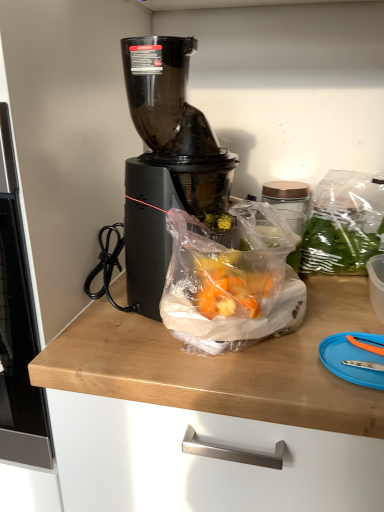
Question: Does translucent plastic bag at center turn towards blue plastic cutting board at lower right?

Choices:
 (A) no
 (B) yes

Answer: (A)

Question: Is translucent plastic bag at center surrounding blue plastic cutting board at lower right?

Choices:
 (A) yes
 (B) no

Answer: (B)

Question: Can you confirm if translucent plastic bag at center is thinner than blue plastic cutting board at lower right?

Choices:
 (A) no
 (B) yes

Answer: (A)

Question: Can you confirm if translucent plastic bag at center is smaller than blue plastic cutting board at lower right?

Choices:
 (A) no
 (B) yes

Answer: (A)

Question: From the image's perspective, is translucent plastic bag at center over blue plastic cutting board at lower right?

Choices:
 (A) yes
 (B) no

Answer: (A)

Question: Is the depth of translucent plastic bag at center greater than that of blue plastic cutting board at lower right?

Choices:
 (A) no
 (B) yes

Answer: (A)

Question: Is translucent plastic bag at center oriented towards black plastic blender at center?

Choices:
 (A) no
 (B) yes

Answer: (A)

Question: Is translucent plastic bag at center next to black plastic blender at center?

Choices:
 (A) yes
 (B) no

Answer: (B)

Question: Would you say translucent plastic bag at center is outside black plastic blender at center?

Choices:
 (A) no
 (B) yes

Answer: (A)

Question: Does translucent plastic bag at center have a lesser width compared to black plastic blender at center?

Choices:
 (A) no
 (B) yes

Answer: (B)

Question: Can you confirm if translucent plastic bag at center is bigger than black plastic blender at center?

Choices:
 (A) no
 (B) yes

Answer: (A)

Question: Considering the relative sizes of translucent plastic bag at center and black plastic blender at center in the image provided, is translucent plastic bag at center taller than black plastic blender at center?

Choices:
 (A) no
 (B) yes

Answer: (A)

Question: Is black plastic blender at center not close to blue plastic cutting board at lower right?

Choices:
 (A) yes
 (B) no

Answer: (B)